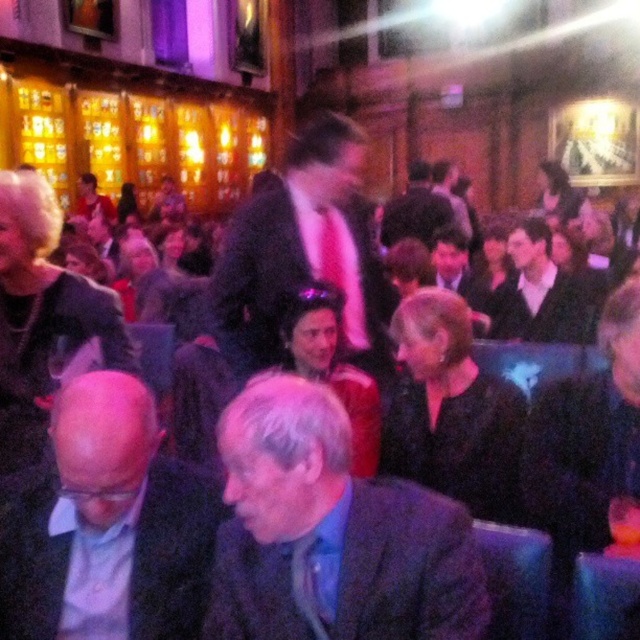
How far apart are bald head at center and matte black jacket at upper left?

bald head at center is 55.10 feet from matte black jacket at upper left.

Who is more forward, (209, 560) or (83, 180)?

Point (209, 560) is more forward.

Between point (156, 440) and point (83, 209), which one is positioned in front?

Point (156, 440)

The height and width of the screenshot is (640, 640). What are the coordinates of `bald head at center` in the screenshot? It's located at (108, 525).

Is dark gray suit at center shorter than pink satin tie at center?

Correct, dark gray suit at center is not as tall as pink satin tie at center.

Describe the element at coordinates (588, 436) in the screenshot. I see `dark gray suit at center` at that location.

What do you see at coordinates (588, 436) in the screenshot? Image resolution: width=640 pixels, height=640 pixels. I see `dark gray suit at center` at bounding box center [588, 436].

The width and height of the screenshot is (640, 640). What are the coordinates of `dark gray suit at center` in the screenshot? It's located at (588, 436).

Can you confirm if matte black suit at center is thinner than dark gray suit at center?

No.

Who is higher up, matte black suit at center or dark gray suit at center?

Positioned higher is matte black suit at center.

Is point (336, 205) less distant than point (570, 403)?

No, it is behind (570, 403).

I want to click on matte black suit at center, so click(x=301, y=253).